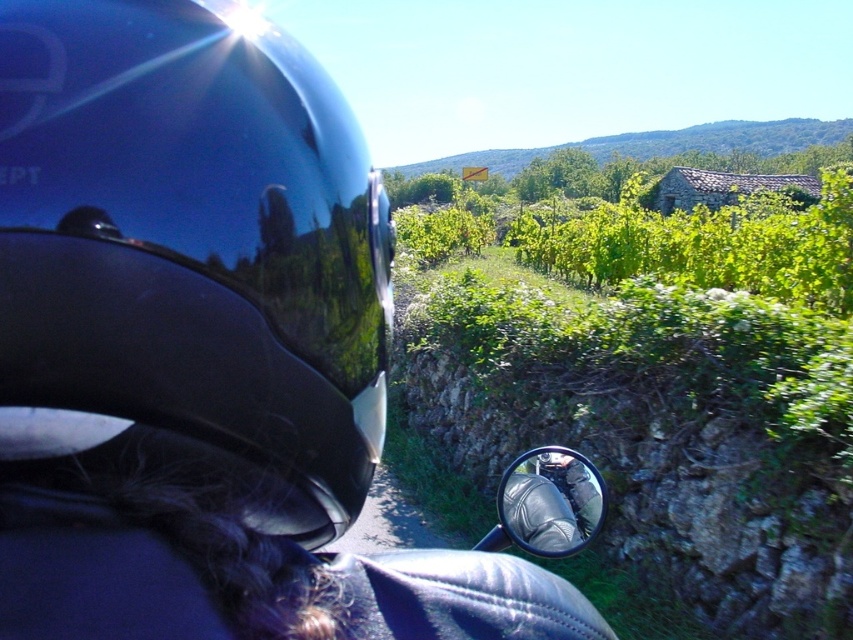
Can you confirm if glossy black helmet at left is positioned above glossy metallic mirror at center?

Correct, glossy black helmet at left is located above glossy metallic mirror at center.

Is glossy black helmet at left positioned in front of glossy metallic mirror at center?

A: Yes, it is.

What do you see at coordinates (193, 241) in the screenshot?
I see `glossy black helmet at left` at bounding box center [193, 241].

Where is `glossy black helmet at left`? glossy black helmet at left is located at coordinates (193, 241).